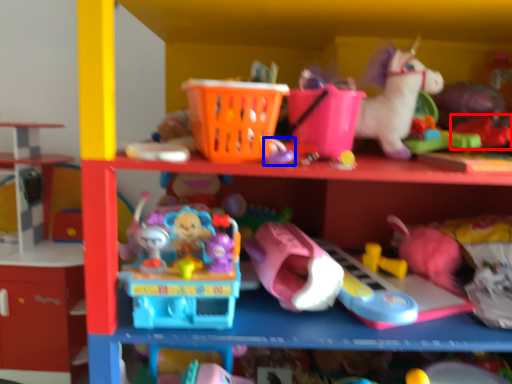
Question: Which object appears farthest to the camera in this image, toy (highlighted by a red box) or toy (highlighted by a blue box)?

Choices:
 (A) toy
 (B) toy

Answer: (A)